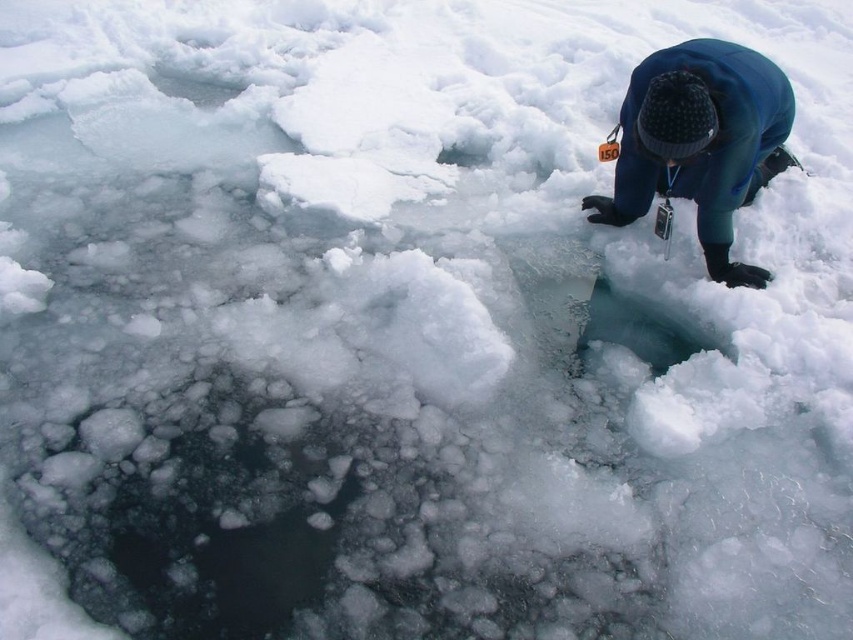
Does blue fleece jacket at upper right come behind transparent ice hole at center?

That is False.

Who is taller, blue fleece jacket at upper right or transparent ice hole at center?

Standing taller between the two is blue fleece jacket at upper right.

You are a GUI agent. You are given a task and a screenshot of the screen. Output one action in this format:
    pyautogui.click(x=<x>, y=<y>)
    Task: Click on the blue fleece jacket at upper right
    The height and width of the screenshot is (640, 853).
    Given the screenshot: What is the action you would take?
    pyautogui.click(x=700, y=141)

Where is `blue fleece jacket at upper right`? The height and width of the screenshot is (640, 853). blue fleece jacket at upper right is located at coordinates (700, 141).